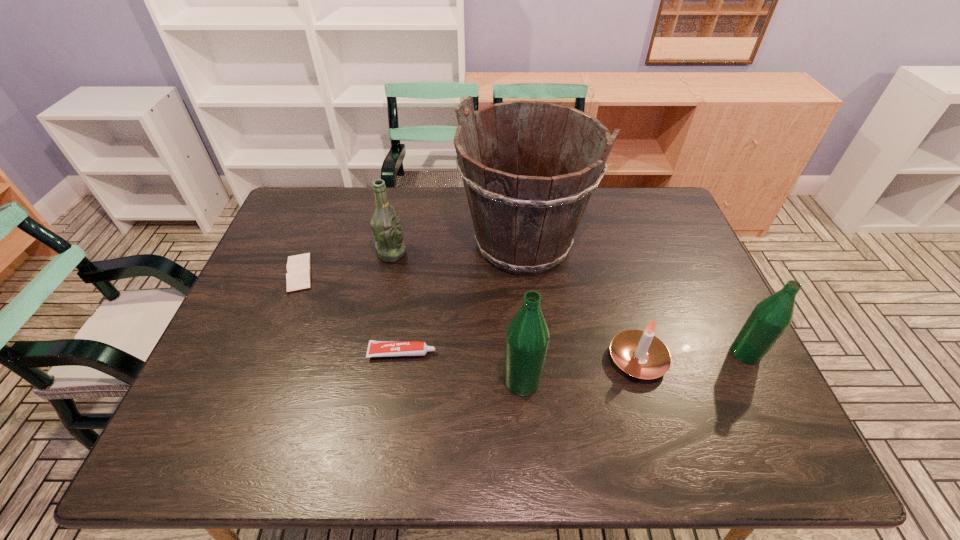
I want to click on the left bottle, so click(527, 337).

In order to click on the rightmost object in this screenshot , I will do `click(770, 318)`.

Where is `the shorter bottle`? the shorter bottle is located at coordinates (770, 318).

The image size is (960, 540). Find the location of `the shortest object`. the shortest object is located at coordinates (298, 276).

Locate an element on the screen. The image size is (960, 540). diary is located at coordinates (298, 276).

Where is `the tallest object`? The width and height of the screenshot is (960, 540). the tallest object is located at coordinates (525, 217).

Where is `beer bottle`? Image resolution: width=960 pixels, height=540 pixels. beer bottle is located at coordinates (387, 231).

Where is `the second shortest object`? This screenshot has width=960, height=540. the second shortest object is located at coordinates (375, 348).

The height and width of the screenshot is (540, 960). Identify the location of the third shortest object. (638, 353).

Locate an element on the screen. The width and height of the screenshot is (960, 540). free spot located on the back of the left bottle is located at coordinates (513, 253).